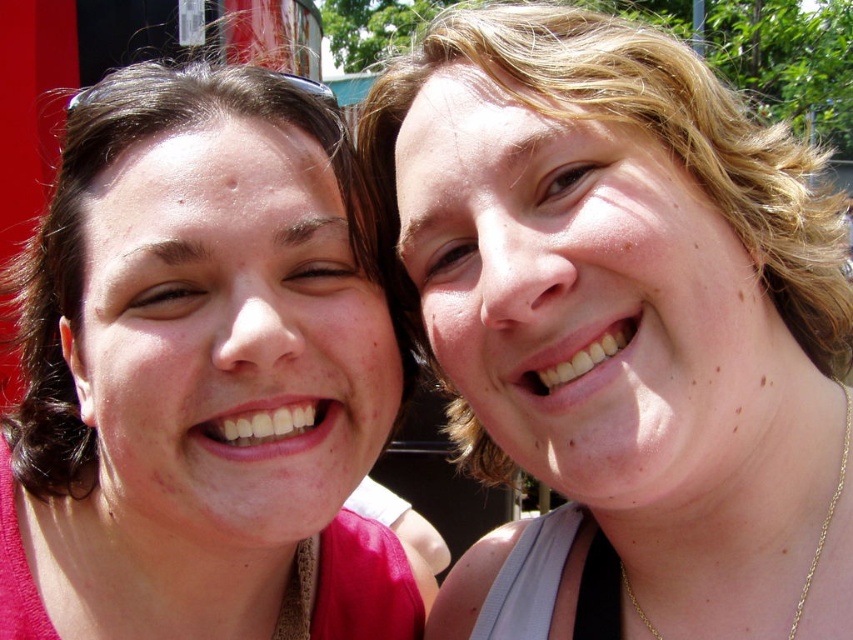
Question: Which object is positioned closest to the gold chain at lower right?

Choices:
 (A) matte pink shirt at left
 (B) matte skin at center

Answer: (B)

Question: Based on their relative distances, which object is nearer to the gold chain at lower right?

Choices:
 (A) matte skin at center
 (B) matte pink shirt at left

Answer: (A)

Question: Observing the image, what is the correct spatial positioning of matte skin at center in reference to matte pink shirt at left?

Choices:
 (A) above
 (B) below

Answer: (A)

Question: Which object appears closest to the camera in this image?

Choices:
 (A) matte skin at center
 (B) matte pink shirt at left

Answer: (A)

Question: Does matte skin at center appear under gold chain at lower right?

Choices:
 (A) no
 (B) yes

Answer: (A)

Question: Does matte pink shirt at left appear under gold chain at lower right?

Choices:
 (A) no
 (B) yes

Answer: (A)